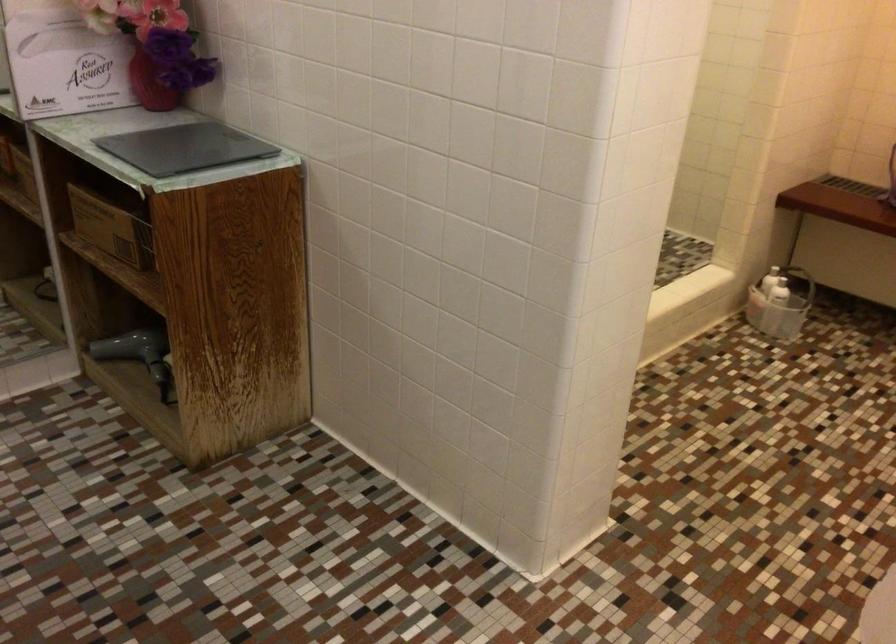
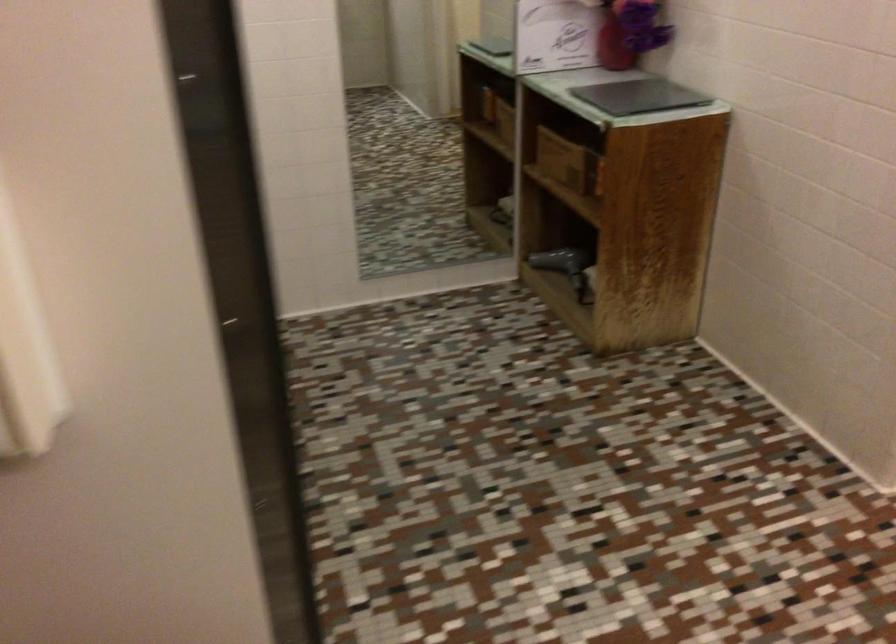
The point at (x=187, y=290) is marked in the first image. Where is the corresponding point in the second image?

(616, 207)